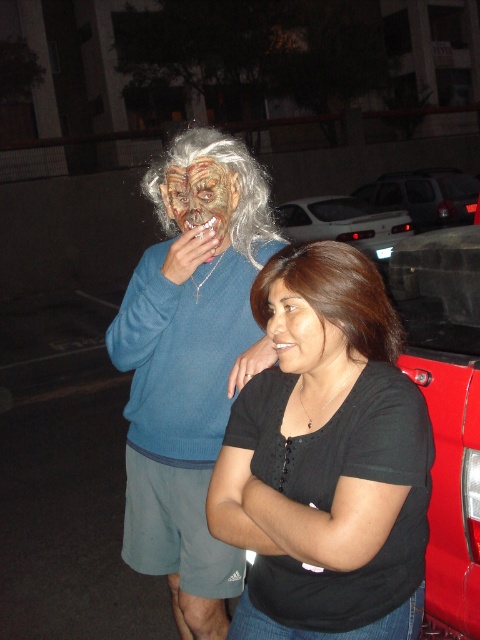
Measure the distance between black matte shirt at center and brown smooth hair at center.

black matte shirt at center and brown smooth hair at center are 7.66 inches apart from each other.

The width and height of the screenshot is (480, 640). Describe the element at coordinates (326, 460) in the screenshot. I see `black matte shirt at center` at that location.

Does point (300, 612) come behind point (365, 336)?

Yes, point (300, 612) is behind point (365, 336).

You are a GUI agent. You are given a task and a screenshot of the screen. Output one action in this format:
    pyautogui.click(x=<x>, y=<y>)
    Task: Click on the black matte shirt at center
    
    Given the screenshot: What is the action you would take?
    pyautogui.click(x=326, y=460)

Find the location of `black matte shirt at center`. black matte shirt at center is located at coordinates (326, 460).

Does black matte shirt at center have a larger size compared to metallic silver pickup truck at center right?

No, black matte shirt at center is not bigger than metallic silver pickup truck at center right.

The height and width of the screenshot is (640, 480). What do you see at coordinates (326, 460) in the screenshot? I see `black matte shirt at center` at bounding box center [326, 460].

Locate an element on the screen. black matte shirt at center is located at coordinates (326, 460).

Locate an element on the screen. The image size is (480, 640). red matte truck at right is located at coordinates (445, 410).

Is point (452, 516) behind point (371, 275)?

Yes, point (452, 516) is behind point (371, 275).

Find the location of a particular element. The image size is (480, 640). red matte truck at right is located at coordinates (445, 410).